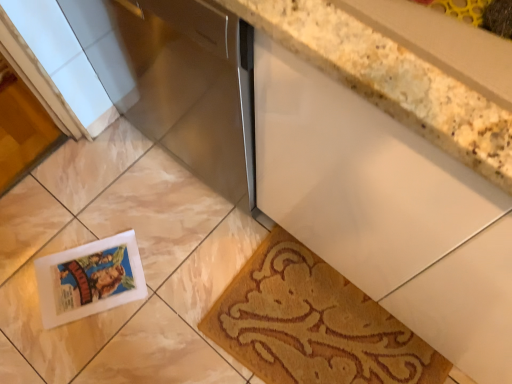
This screenshot has width=512, height=384. I want to click on unoccupied space behind white glossy postcard at lower left, so click(x=97, y=200).